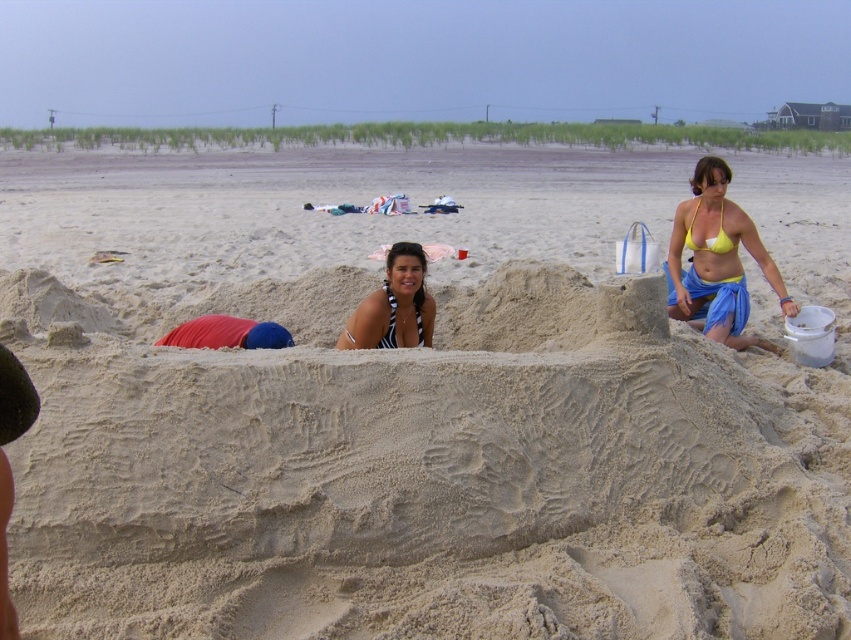
Between yellow bikini top at upper right and yellow matte bikini top at upper center, which one has less height?

yellow matte bikini top at upper center

Between point (766, 278) and point (724, 232), which one is positioned behind?

Point (766, 278)

Where is `yellow bikini top at upper right`? The height and width of the screenshot is (640, 851). yellow bikini top at upper right is located at coordinates (717, 260).

Can you confirm if yellow bikini top at upper right is shorter than black striped bikini top at center?

No.

Is point (706, 291) positioned behind point (407, 326)?

Yes, point (706, 291) is farther from viewer.

This screenshot has width=851, height=640. Find the location of `yellow bikini top at upper right`. yellow bikini top at upper right is located at coordinates (717, 260).

Which is above, black striped bikini top at center or yellow matte bikini top at upper center?

yellow matte bikini top at upper center

Is point (407, 289) closer to camera compared to point (688, 259)?

Yes, point (407, 289) is in front of point (688, 259).

Locate an element on the screen. black striped bikini top at center is located at coordinates (393, 305).